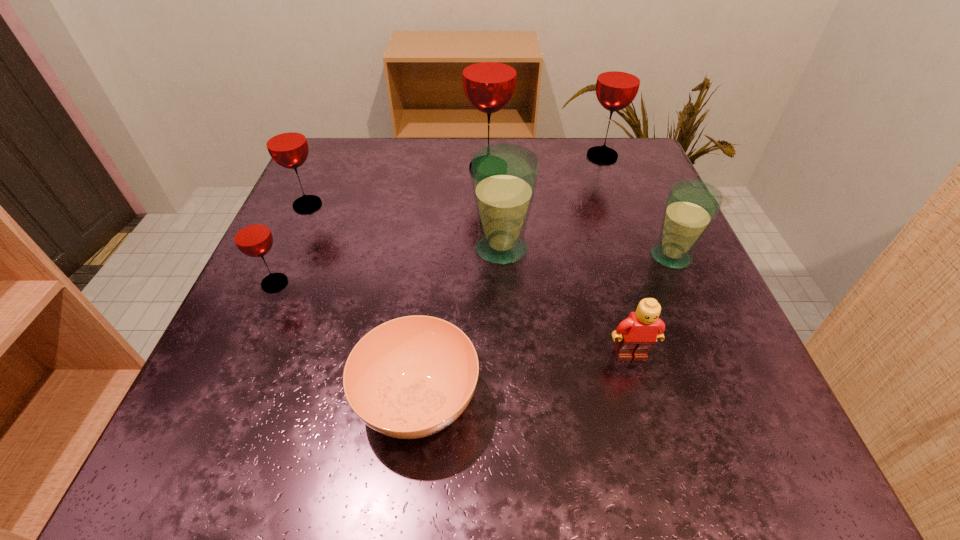
The image size is (960, 540). I want to click on free space between the bigger blue glass and the second nearest red glass, so click(x=404, y=227).

I want to click on free space that is in between the bigger blue glass and the soup bowl, so click(460, 325).

This screenshot has height=540, width=960. What are the coordinates of `vacant area that lies between the third farthest red glass and the peach soup bowl` in the screenshot? It's located at (363, 302).

You are a GUI agent. You are given a task and a screenshot of the screen. Output one action in this format:
    pyautogui.click(x=<x>, y=<y>)
    Task: Click on the closest object to the second shortest object
    
    Given the screenshot: What is the action you would take?
    pyautogui.click(x=691, y=206)

Choose which object is the seventh nearest neighbor to the smallest red glass. Please provide its 2D coordinates. Your answer should be formatted as a tuple, i.e. [(x, y)], where the tuple contains the x and y coordinates of a point satisfying the conditions above.

[(618, 81)]

Choose which glass is the fourth nearest neighbor to the biggest red glass. Please provide its 2D coordinates. Your answer should be formatted as a tuple, i.e. [(x, y)], where the tuple contains the x and y coordinates of a point satisfying the conditions above.

[(691, 206)]

The height and width of the screenshot is (540, 960). I want to click on glass object that ranks as the fourth closest to the rightmost red glass, so click(x=286, y=142).

Find the location of a particular element. the third closest red glass to the peach soup bowl is located at coordinates (489, 69).

Locate which red glass is the closest to the fourth nearest glass. Please provide its 2D coordinates. Your answer should be formatted as a tuple, i.e. [(x, y)], where the tuple contains the x and y coordinates of a point satisfying the conditions above.

[(252, 236)]

Find the location of a particular element. The image size is (960, 540). vacant space that satisfies the following two spatial constraints: 1. on the front side of the peach soup bowl; 2. on the left side of the sixth nearest object is located at coordinates (220, 401).